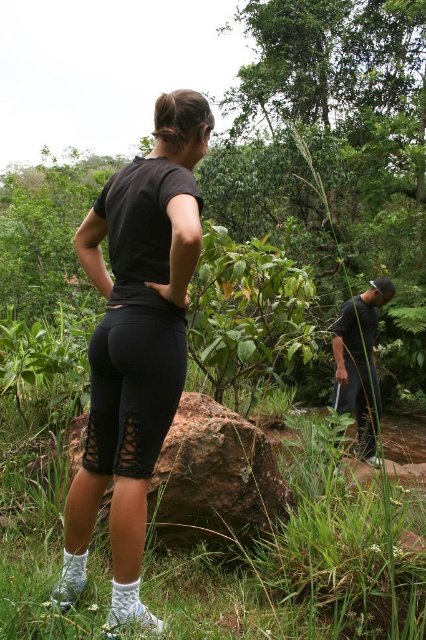
You are a fashion designer observing the image. You need to determine the layering of clothing items. Which clothing item is covering the other? The black matte leggings at center and the dark gray fabric shirt at center are both visible. Based on their positions, which one is on top?

The black matte leggings at center is positioned over dark gray fabric shirt at center, meaning the leggings are covering the shirt.

You are an observer looking at the scene. You notice the black mesh leggings at center and the dark gray fabric shirt at center. Which clothing item appears shorter in the image?

The black mesh leggings at center appears shorter than the dark gray fabric shirt at center.

You are an observer in the forest scene. You notice the black mesh leggings at center and the dark gray fabric shirt at center. Which clothing item appears narrower in the image?

The black mesh leggings at center has a lesser width compared to the dark gray fabric shirt at center, so the black mesh leggings at center appears narrower.